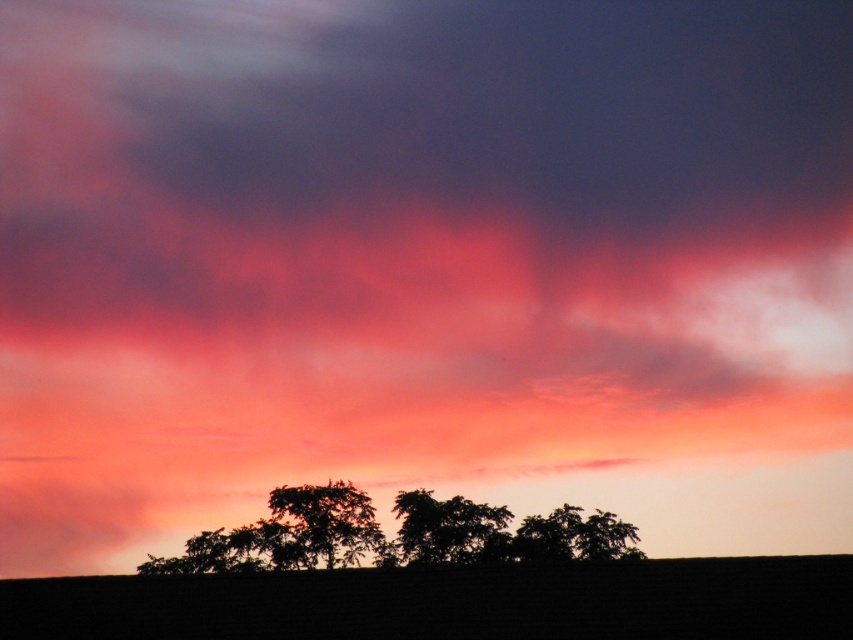
You are an artist trying to paint the sunset scene. You want to ensure the silhouette trees at center and the silhouette leafy tree at center are arranged correctly. Which one should be placed lower in your painting?

The silhouette trees at center should be placed lower in the painting because the silhouette trees at center is positioned under the silhouette leafy tree at center according to the description.

You are an artist trying to paint the sunset scene. You need to place the silhouette trees at center and the silhouette leafy tree at center accurately. Based on the scene description, which tree is positioned to the left?

The silhouette trees at center is positioned to the left of the silhouette leafy tree at center.